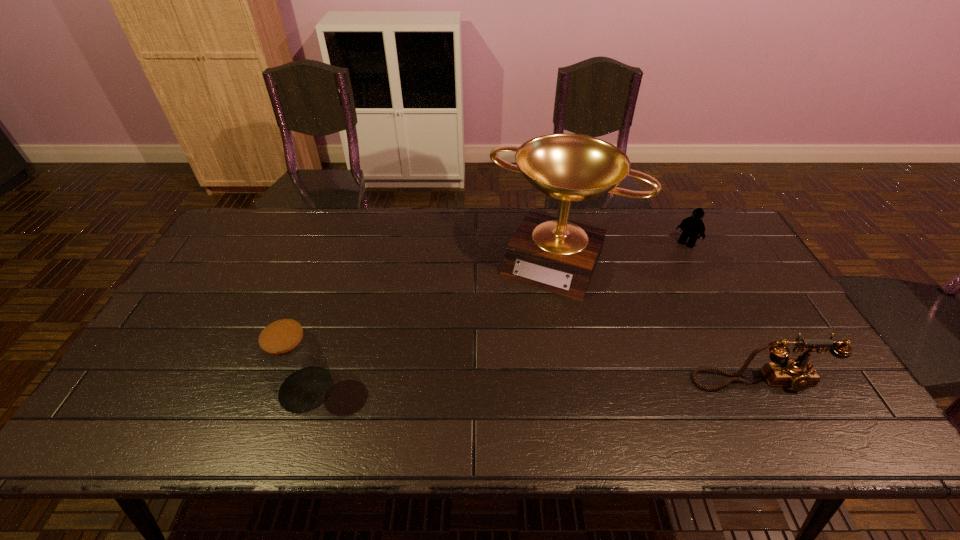
In order to click on free space located on the front-facing side of the tallest object in this screenshot , I will do `click(528, 312)`.

Locate an element on the screen. free location located on the front-facing side of the tallest object is located at coordinates (492, 385).

You are a GUI agent. You are given a task and a screenshot of the screen. Output one action in this format:
    pyautogui.click(x=<x>, y=<y>)
    Task: Click on the vacant area situated on the front-facing side of the tallest object
    
    Given the screenshot: What is the action you would take?
    pyautogui.click(x=514, y=343)

In order to click on Lego at the far edge in this screenshot , I will do `click(693, 226)`.

I want to click on award present at the far edge, so click(554, 254).

This screenshot has height=540, width=960. Find the location of `jar present at the near edge`. jar present at the near edge is located at coordinates (290, 357).

At what (x,y) coordinates should I click in order to perform the action: click on telephone situated at the near edge. Please return your answer as a coordinate pair (x, y). Looking at the image, I should click on (798, 373).

The width and height of the screenshot is (960, 540). I want to click on telephone that is at the right edge, so click(798, 373).

Where is `Lego that is positioned at the right edge`? The image size is (960, 540). Lego that is positioned at the right edge is located at coordinates (693, 226).

Identify the location of object that is at the far right corner. This screenshot has height=540, width=960. (693, 226).